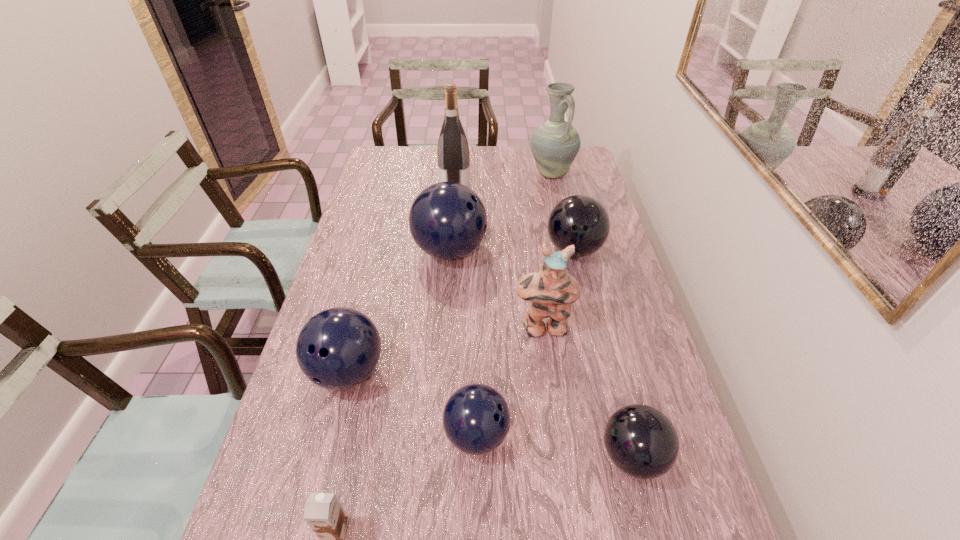
Where is `wine bottle`? Image resolution: width=960 pixels, height=540 pixels. wine bottle is located at coordinates (453, 155).

I want to click on the eighth shortest object, so click(555, 144).

This screenshot has width=960, height=540. I want to click on figurine, so click(551, 291).

Find the location of `pink figurine`. pink figurine is located at coordinates (551, 291).

Find the location of `the farthest blue bowling ball`. the farthest blue bowling ball is located at coordinates (447, 220).

Find the location of a particular element. Image resolution: width=960 pixels, height=540 pixels. the tallest bowling ball is located at coordinates (447, 220).

The image size is (960, 540). Identify the location of the bigger black bowling ball. (579, 220).

Where is `the leftmost bowling ball`? the leftmost bowling ball is located at coordinates (338, 348).

Locate an element on the screen. the second biggest blue bowling ball is located at coordinates (338, 348).

At what (x,y) coordinates should I click in order to perform the action: click on the smallest blue bowling ball. Please return your answer as a coordinate pair (x, y). The width and height of the screenshot is (960, 540). Looking at the image, I should click on (476, 419).